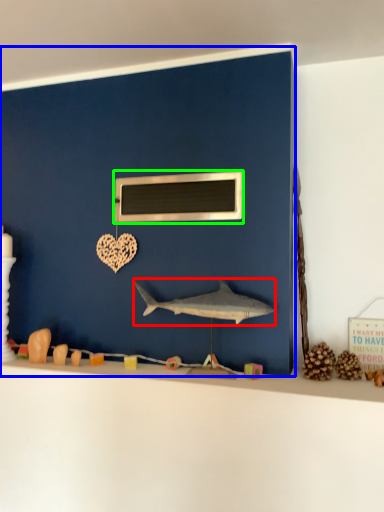
Question: Based on their relative distances, which object is farther from shark (highlighted by a red box)? Choose from backdrop (highlighted by a blue box) and medicine cabinet (highlighted by a green box).

Choices:
 (A) backdrop
 (B) medicine cabinet

Answer: (A)